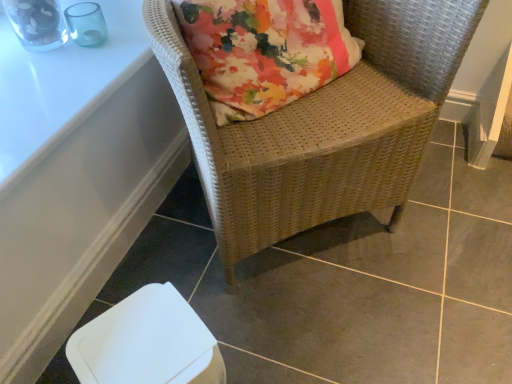
At what (x,y) coordinates should I click in order to perform the action: click on free location above white plastic swivel chair at lower left (from a real-world perspective). Please return your answer as a coordinate pair (x, y). The image size is (512, 384). Looking at the image, I should click on (146, 345).